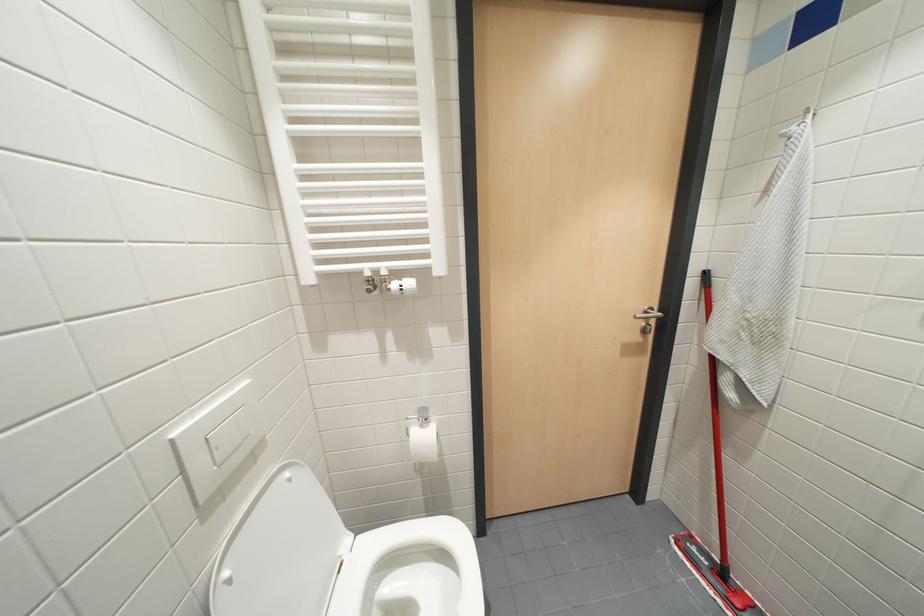
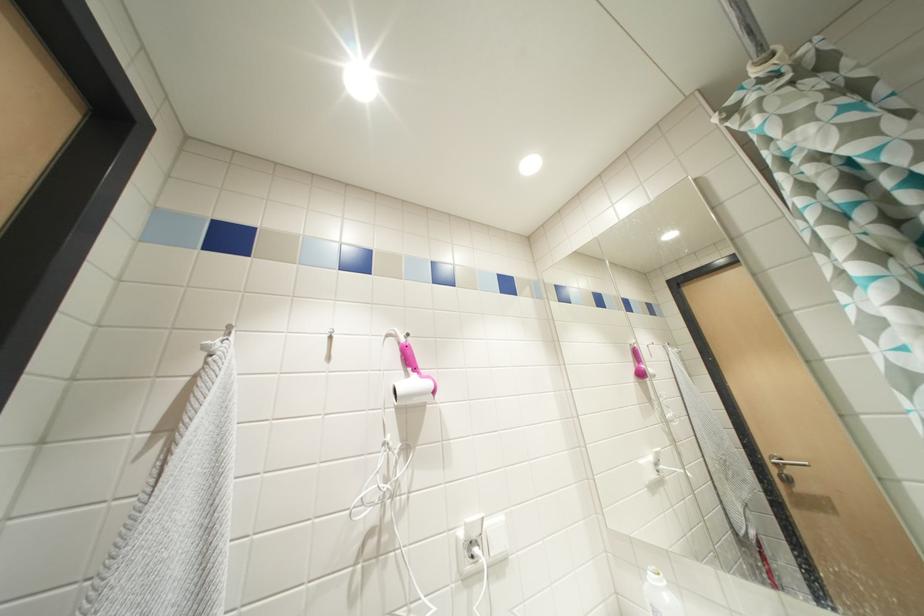
The images are taken continuously from a first-person perspective. In which direction is your viewpoint rotating?

The camera rotated toward right-up.